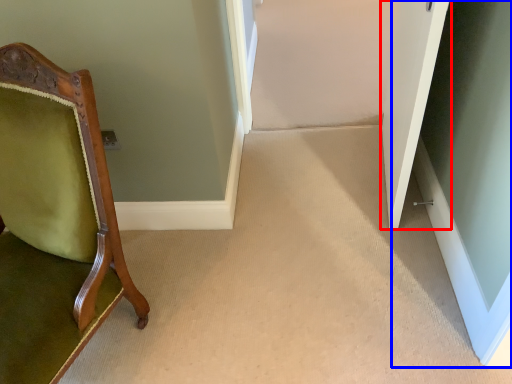
Question: Which point is further to the camera, door (highlighted by a red box) or glass door (highlighted by a blue box)?

Choices:
 (A) door
 (B) glass door

Answer: (B)